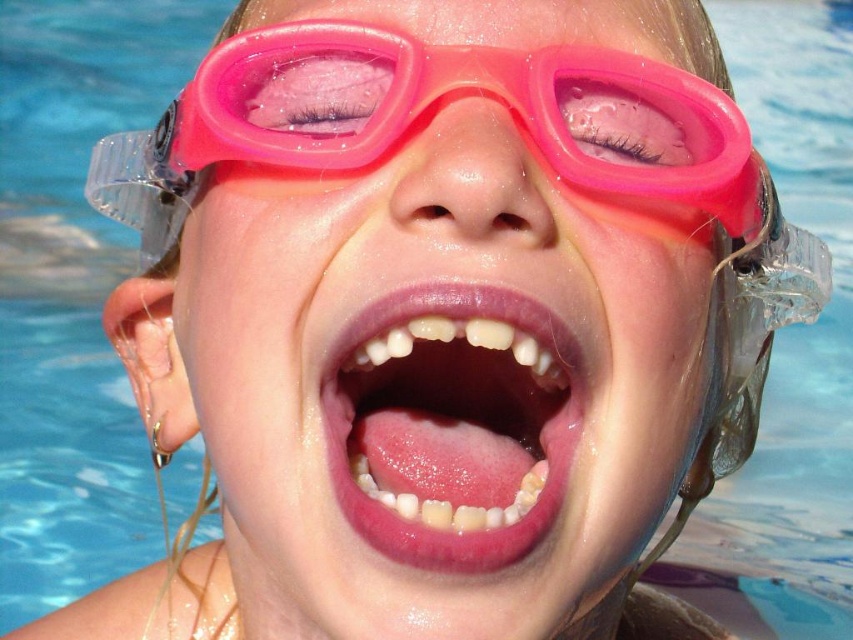
Question: Which point appears farthest from the camera in this image?

Choices:
 (A) (379, 506)
 (B) (425, 83)

Answer: (B)

Question: Is pink rubber goggles at center positioned behind pink glossy lips at center?

Choices:
 (A) no
 (B) yes

Answer: (B)

Question: Which point is closer to the camera?

Choices:
 (A) (445, 378)
 (B) (200, 161)

Answer: (B)

Question: Does pink rubber goggles at center appear on the right side of pink glossy lips at center?

Choices:
 (A) no
 (B) yes

Answer: (A)

Question: Which point is farther from the camera taking this photo?

Choices:
 (A) pyautogui.click(x=167, y=166)
 (B) pyautogui.click(x=355, y=419)

Answer: (A)

Question: Is pink rubber goggles at center to the right of pink glossy lips at center from the viewer's perspective?

Choices:
 (A) no
 (B) yes

Answer: (A)